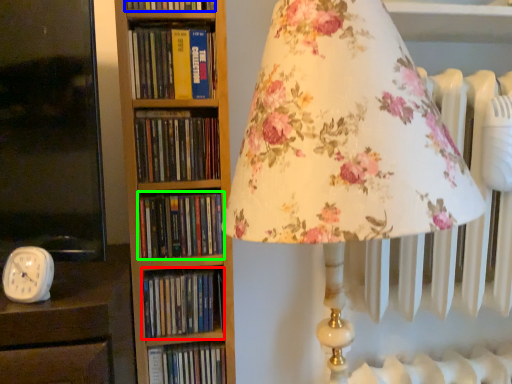
Question: Which object is positioned closest to book (highlighted by a red box)? Select from book (highlighted by a blue box) and book (highlighted by a green box).

Choices:
 (A) book
 (B) book

Answer: (B)